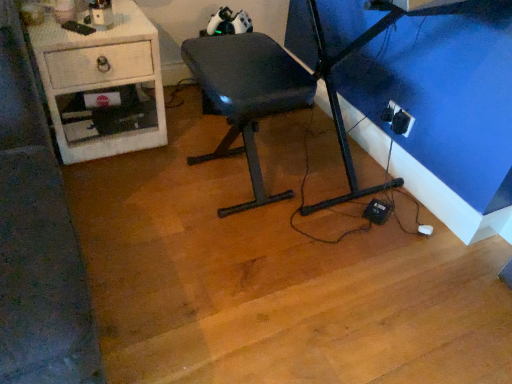
Where is `vacant area situated to the left side of matte black chair at center`? vacant area situated to the left side of matte black chair at center is located at coordinates (139, 187).